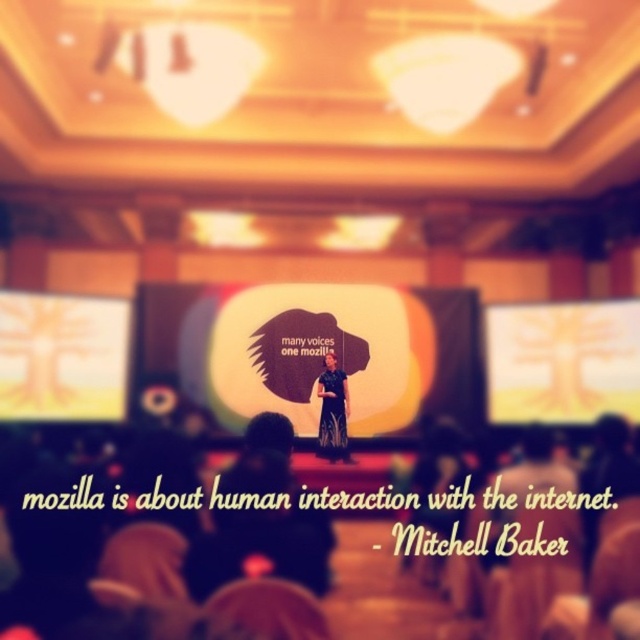
You are an event planner who needs to adjust the lighting for the presentation. The yellow matte projection screen at upper center and the black satin dress at center are both in the spotlight. Given that the screen is 8.68 feet away from the dress, will the light from the spotlight reach both objects equally?

The yellow matte projection screen at upper center is 8.68 feet away from the black satin dress at center. Since the distance between them is significant, the light from the spotlight may not reach both objects equally. The dress at center might receive more direct light, while the screen could be slightly dimmer due to the distance.

In the presentation setting, where is the white matte projection screen at center located in terms of coordinates?

The white matte projection screen at center is located at coordinates point [308,353].

Looking at this image, you are an event organizer setting up for a presentation. You have two screens available, the white matte projection screen at center and the yellow matte projection screen at upper center. Which screen should you use if you need a taller display for your presentation slides?

The white matte projection screen at center is taller than the yellow matte projection screen at upper center, so you should use the white matte projection screen at center for a taller display.